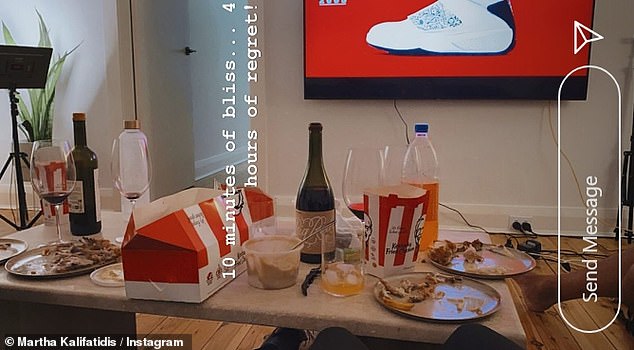
Where is `door handle`? This screenshot has width=634, height=350. door handle is located at coordinates (191, 50).